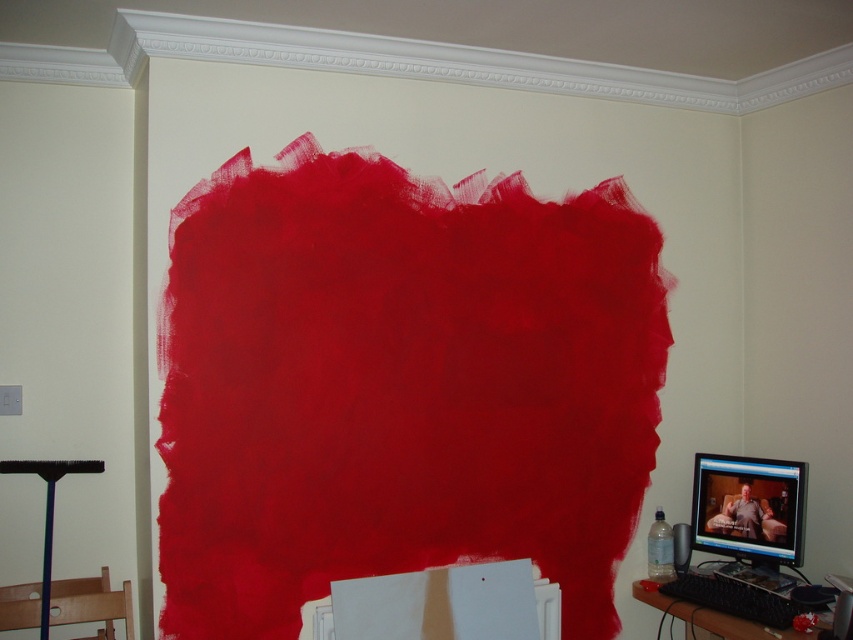
Question: Which point appears closest to the camera in this image?

Choices:
 (A) (51, 531)
 (B) (686, 612)
 (C) (726, 490)

Answer: (A)

Question: Is matte black keyboard at lower right closer to camera compared to matte black brush at lower left?

Choices:
 (A) no
 (B) yes

Answer: (B)

Question: Is matte black monitor at lower right to the left of matte black keyboard at lower right from the viewer's perspective?

Choices:
 (A) no
 (B) yes

Answer: (A)

Question: Which object appears farthest from the camera in this image?

Choices:
 (A) matte black keyboard at lower right
 (B) matte black monitor at lower right
 (C) matte black brush at lower left

Answer: (B)

Question: Is the position of matte black monitor at lower right less distant than that of matte black brush at lower left?

Choices:
 (A) yes
 (B) no

Answer: (B)

Question: Which of the following is the closest to the observer?

Choices:
 (A) click(x=47, y=544)
 (B) click(x=727, y=632)

Answer: (B)